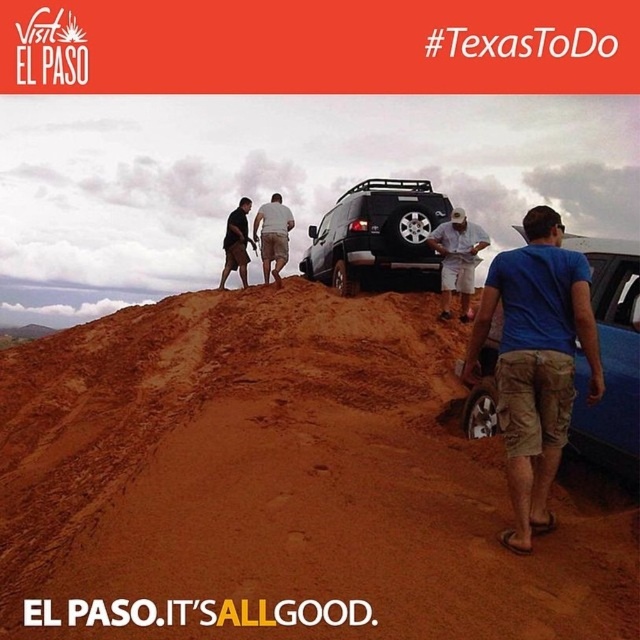
Between brown sandy soil at center and dark brown shorts at upper center, which one is positioned lower?

brown sandy soil at center is lower down.

Can you confirm if brown sandy soil at center is wider than dark brown shorts at upper center?

Indeed, brown sandy soil at center has a greater width compared to dark brown shorts at upper center.

Does point (221, 368) come behind point (227, 260)?

No, (221, 368) is closer to viewer.

The height and width of the screenshot is (640, 640). I want to click on brown sandy soil at center, so click(282, 481).

Can you confirm if black matte suv at center is thinner than white cotton shirt at center?

Yes.

Does black matte suv at center have a smaller size compared to white cotton shirt at center?

Yes.

Where is `black matte suv at center`? black matte suv at center is located at coordinates click(376, 236).

You are a GUI agent. You are given a task and a screenshot of the screen. Output one action in this format:
    pyautogui.click(x=<x>, y=<y>)
    Task: Click on the black matte suv at center
    This screenshot has width=640, height=640.
    Given the screenshot: What is the action you would take?
    pyautogui.click(x=376, y=236)

Is blue cotton shirt at upper right bigger than dark brown shorts at upper center?

Correct, blue cotton shirt at upper right is larger in size than dark brown shorts at upper center.

Is blue cotton shirt at upper right further to camera compared to dark brown shorts at upper center?

That is False.

Who is more forward, (x=556, y=378) or (x=240, y=220)?

Point (x=556, y=378) is in front.

Where is `blue cotton shirt at upper right`? This screenshot has height=640, width=640. blue cotton shirt at upper right is located at coordinates (536, 360).